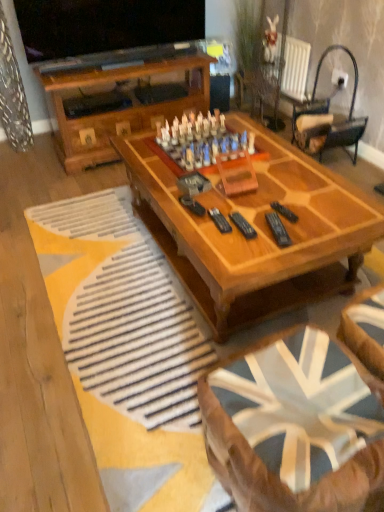
The image size is (384, 512). In order to click on vacant space that is to the left of black plastic remote at center, which appears as the third remote when viewed from the right in this screenshot , I will do `click(206, 227)`.